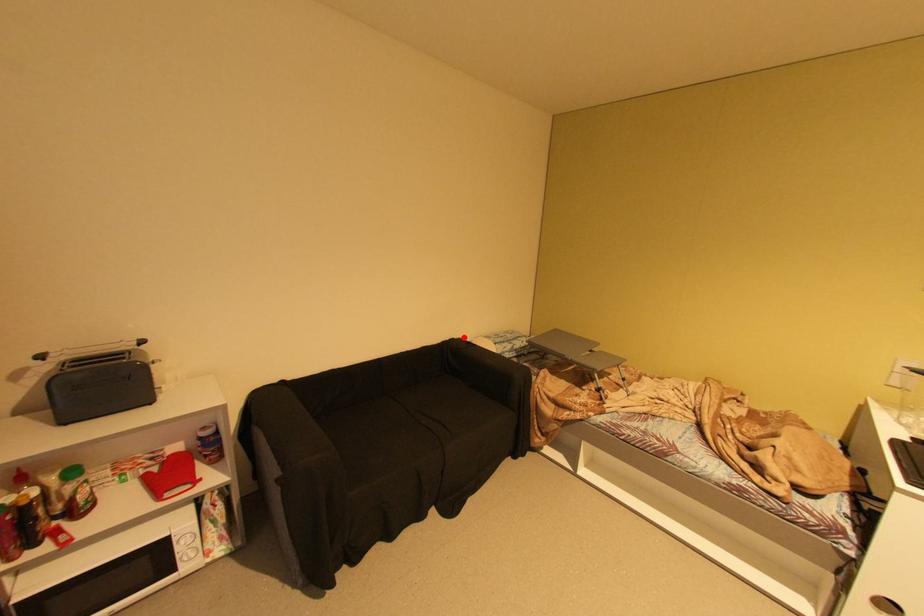
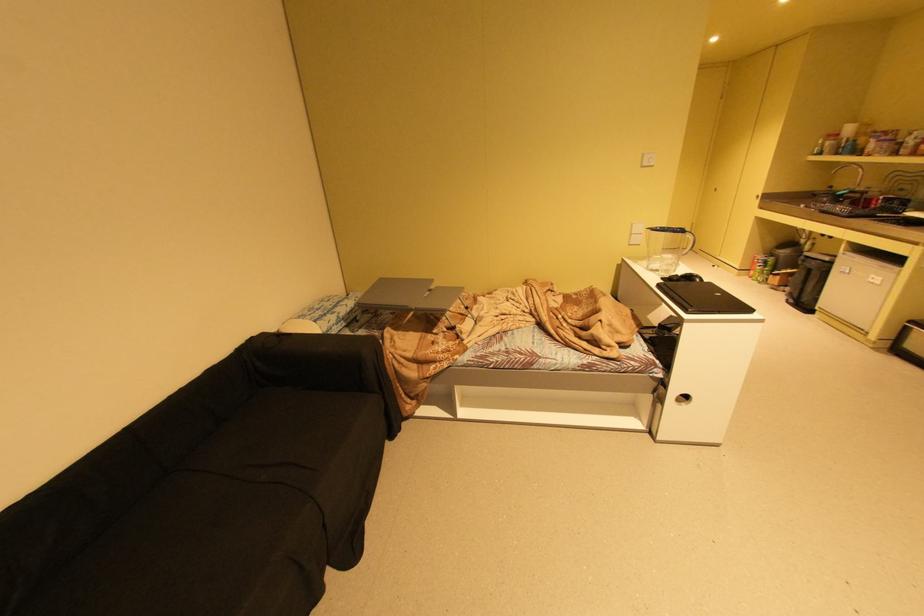
Question: A red point is marked in image1. In image2, is the corresponding 3D point closer to the camera or farther? Reply with the corresponding letter.

Choices:
 (A) The corresponding 3D point is closer.
 (B) The corresponding 3D point is farther.

Answer: (A)